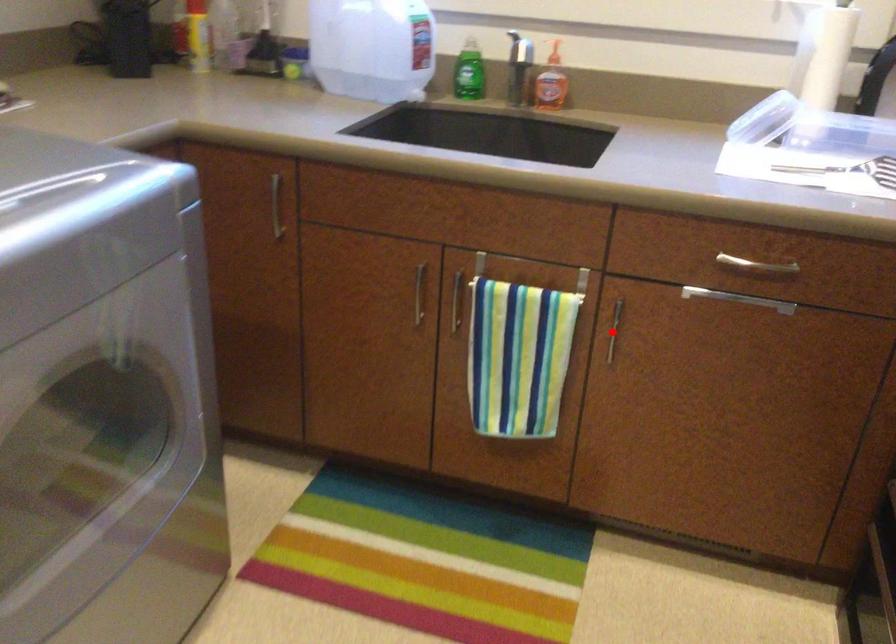
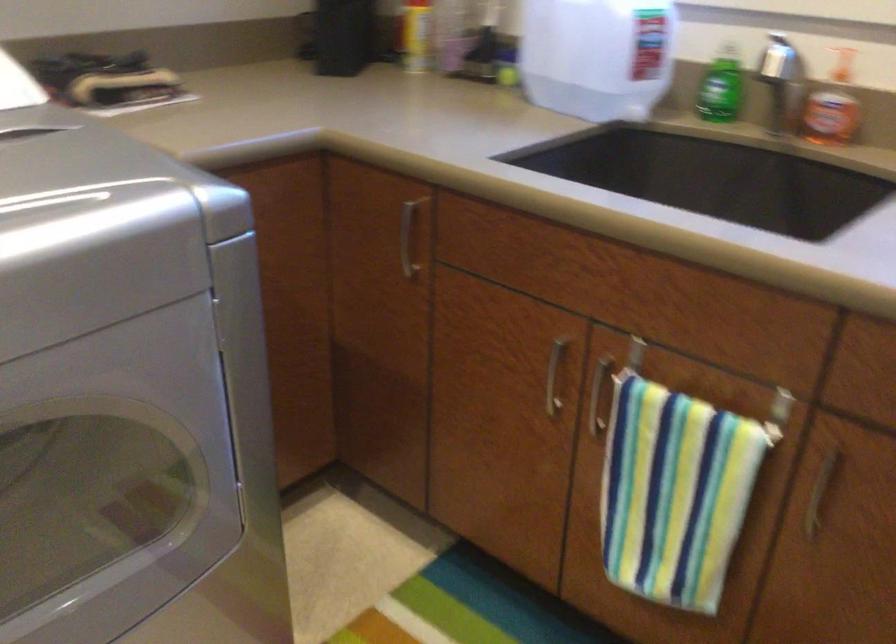
Question: I am providing you with two images of the same scene from different viewpoints. A red point is shown in image1. For the corresponding object point in image2, is it positioned nearer or farther from the camera?

Choices:
 (A) Nearer
 (B) Farther

Answer: (A)